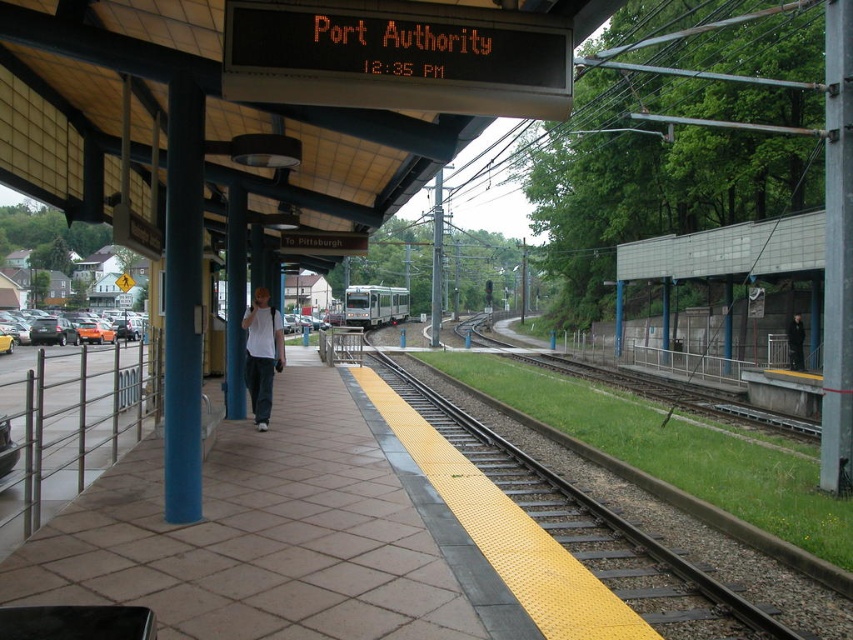
Question: Which point is farther to the camera?

Choices:
 (A) white matte shirt at center
 (B) silver metallic train at center
 (C) brown tile platform at center

Answer: (B)

Question: Is the position of brown tile platform at center more distant than that of yellow rubber train track at center?

Choices:
 (A) yes
 (B) no

Answer: (B)

Question: Estimate the real-world distances between objects in this image. Which object is farther from the brown tile platform at center?

Choices:
 (A) dark gray jacket at center
 (B) yellow rubber train track at center
 (C) white matte shirt at center

Answer: (A)

Question: Does brown tile platform at center appear over silver metallic train at center?

Choices:
 (A) no
 (B) yes

Answer: (A)

Question: Which point appears closest to the camera in this image?

Choices:
 (A) (209, 582)
 (B) (790, 355)
 (C) (622, 577)
 (D) (363, 300)

Answer: (A)

Question: Does yellow rubber train track at center appear on the left side of silver metallic train at center?

Choices:
 (A) no
 (B) yes

Answer: (A)